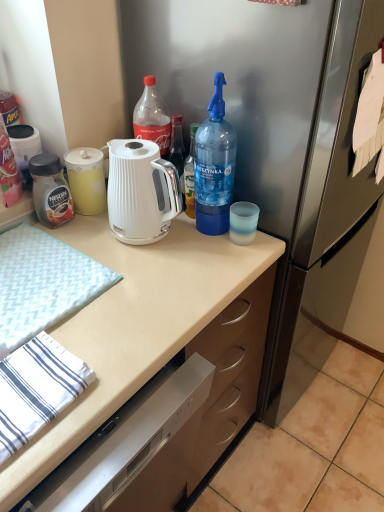
Question: Based on their sizes in the image, would you say white textured hand towel at left is bigger or smaller than white glossy electric kettle at center?

Choices:
 (A) small
 (B) big

Answer: (A)

Question: From a real-world perspective, is white textured hand towel at left above or below white glossy electric kettle at center?

Choices:
 (A) above
 (B) below

Answer: (B)

Question: Which of these objects is positioned closest to the white textured hand towel at left?

Choices:
 (A) blue translucent bottle at right, the 1th bottle when ordered from right to left
 (B) white glossy electric kettle at center
 (C) white matte countertop at center
 (D) matte black jar at left, which is the 1th bottle from left to right
 (E) matte black jar at left, the 2th bottle from the right

Answer: (C)

Question: Based on their relative distances, which object is nearer to the white glossy electric kettle at center?

Choices:
 (A) matte black jar at left, the 2th bottle from the right
 (B) white matte countertop at center
 (C) blue translucent bottle at right, the third bottle in the left-to-right sequence
 (D) white textured hand towel at left
 (E) matte black jar at left, which is the 1th bottle from left to right

Answer: (C)